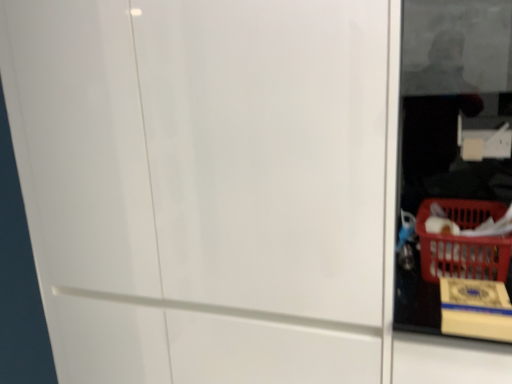
Question: Is yellow cardboard box at lower right wider than red plastic basket at lower right?

Choices:
 (A) no
 (B) yes

Answer: (A)

Question: Is yellow cardboard box at lower right not near red plastic basket at lower right?

Choices:
 (A) no
 (B) yes

Answer: (A)

Question: Considering the relative sizes of yellow cardboard box at lower right and red plastic basket at lower right in the image provided, is yellow cardboard box at lower right smaller than red plastic basket at lower right?

Choices:
 (A) yes
 (B) no

Answer: (A)

Question: Can you confirm if yellow cardboard box at lower right is positioned to the left of red plastic basket at lower right?

Choices:
 (A) no
 (B) yes

Answer: (B)

Question: Is yellow cardboard box at lower right looking in the opposite direction of red plastic basket at lower right?

Choices:
 (A) yes
 (B) no

Answer: (A)

Question: Would you say red plastic basket at lower right is to the left or to the right of yellow cardboard box at lower right in the picture?

Choices:
 (A) left
 (B) right

Answer: (B)

Question: From the image's perspective, relative to yellow cardboard box at lower right, is red plastic basket at lower right above or below?

Choices:
 (A) above
 (B) below

Answer: (A)

Question: Looking at the image, does red plastic basket at lower right seem bigger or smaller compared to yellow cardboard box at lower right?

Choices:
 (A) small
 (B) big

Answer: (B)

Question: Is red plastic basket at lower right inside or outside of yellow cardboard box at lower right?

Choices:
 (A) outside
 (B) inside

Answer: (A)

Question: From a real-world perspective, is yellow cardboard box at lower right physically located above or below red plastic basket at lower right?

Choices:
 (A) below
 (B) above

Answer: (A)

Question: Looking at their shapes, would you say yellow cardboard box at lower right is wider or thinner than red plastic basket at lower right?

Choices:
 (A) thin
 (B) wide

Answer: (A)

Question: Considering the positions of yellow cardboard box at lower right and red plastic basket at lower right in the image, is yellow cardboard box at lower right taller or shorter than red plastic basket at lower right?

Choices:
 (A) tall
 (B) short

Answer: (B)

Question: Is yellow cardboard box at lower right situated inside red plastic basket at lower right or outside?

Choices:
 (A) outside
 (B) inside

Answer: (A)

Question: Is white glossy screen door at center spatially inside red plastic basket at lower right, or outside of it?

Choices:
 (A) inside
 (B) outside

Answer: (B)

Question: From a real-world perspective, is white glossy screen door at center physically located above or below red plastic basket at lower right?

Choices:
 (A) above
 (B) below

Answer: (B)